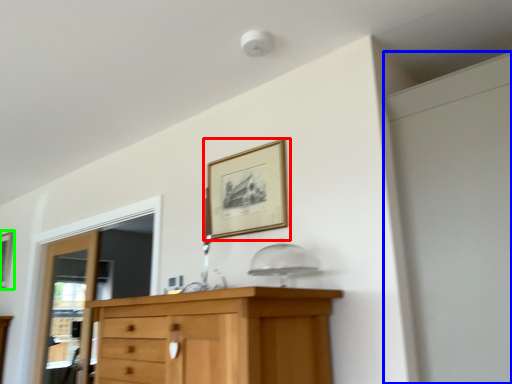
Question: Estimate the real-world distances between objects in this image. Which object is farther from picture frame (highlighted by a red box), screen door (highlighted by a blue box) or picture frame (highlighted by a green box)?

Choices:
 (A) screen door
 (B) picture frame

Answer: (B)